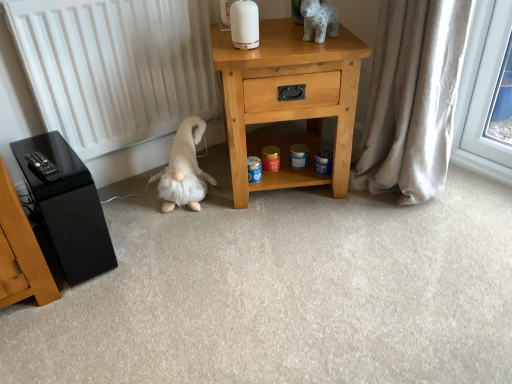
The width and height of the screenshot is (512, 384). What are the coordinates of `vacant space to the right of black glossy speaker at left` in the screenshot? It's located at (148, 249).